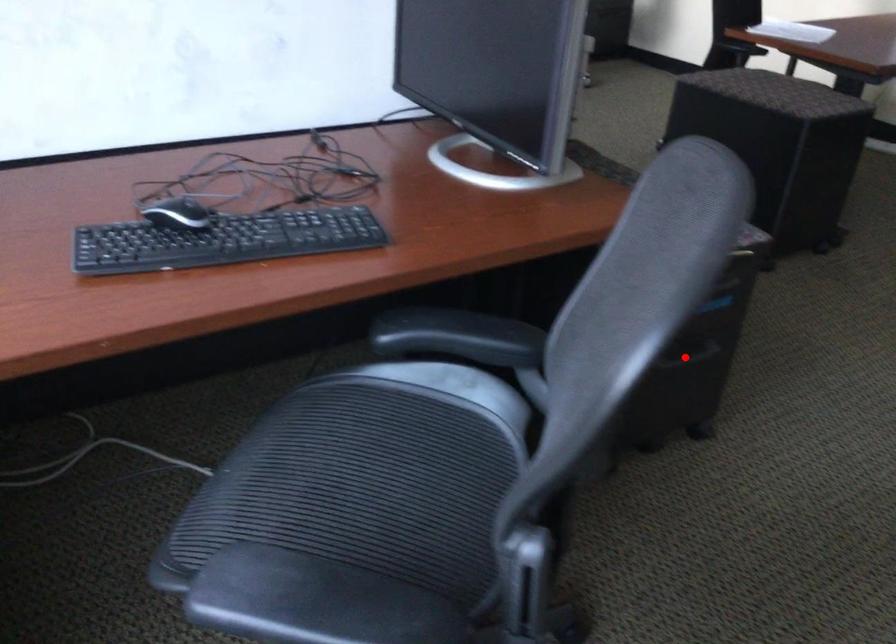
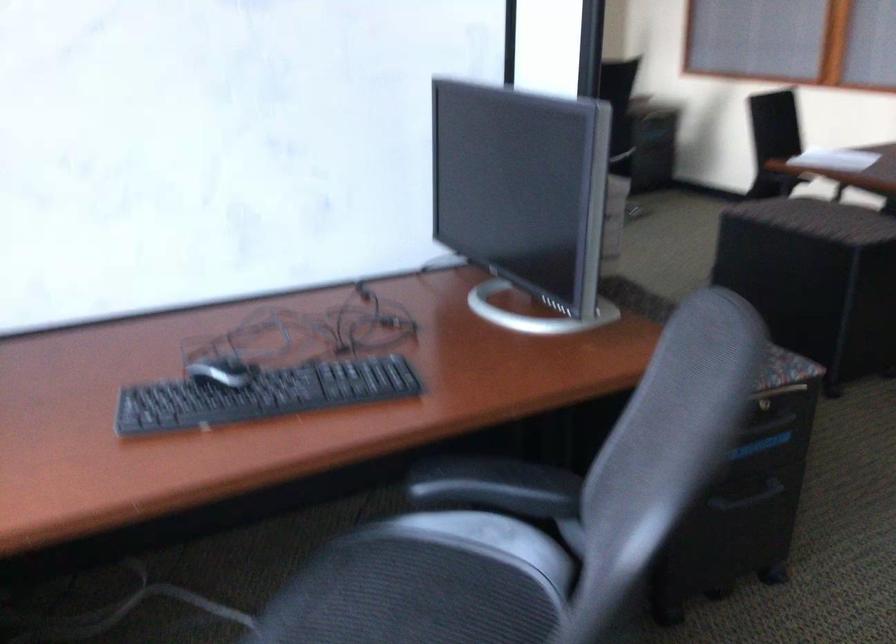
Where in the second image is the point corresponding to the highlighted location from the first image?

(747, 497)